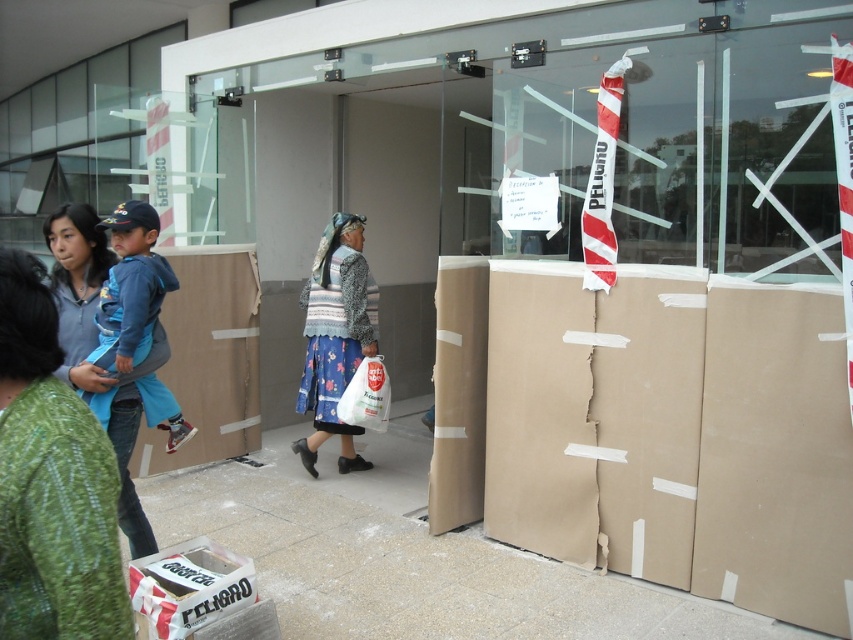
Is point (33, 611) closer to camera compared to point (169, 570)?

Yes, point (33, 611) is in front of point (169, 570).

Who is more forward, (71,541) or (225,563)?

Point (71,541) is in front.

Locate an element on the screen. green textured sweater at center is located at coordinates (51, 481).

Does knitted wool sweater at center have a lesser width compared to white plastic bag at center?

No.

At what (x,y) coordinates should I click in order to perform the action: click on knitted wool sweater at center. Please return your answer as a coordinate pair (x, y). The image size is (853, 640). Looking at the image, I should click on (335, 337).

Does point (357, 272) come closer to viewer compared to point (347, 413)?

No, it is behind (347, 413).

Where is `knitted wool sweater at center`? knitted wool sweater at center is located at coordinates [335, 337].

Does green textured sweater at center have a larger size compared to matte gray hoodie at left?

Actually, green textured sweater at center might be smaller than matte gray hoodie at left.

I want to click on green textured sweater at center, so tap(51, 481).